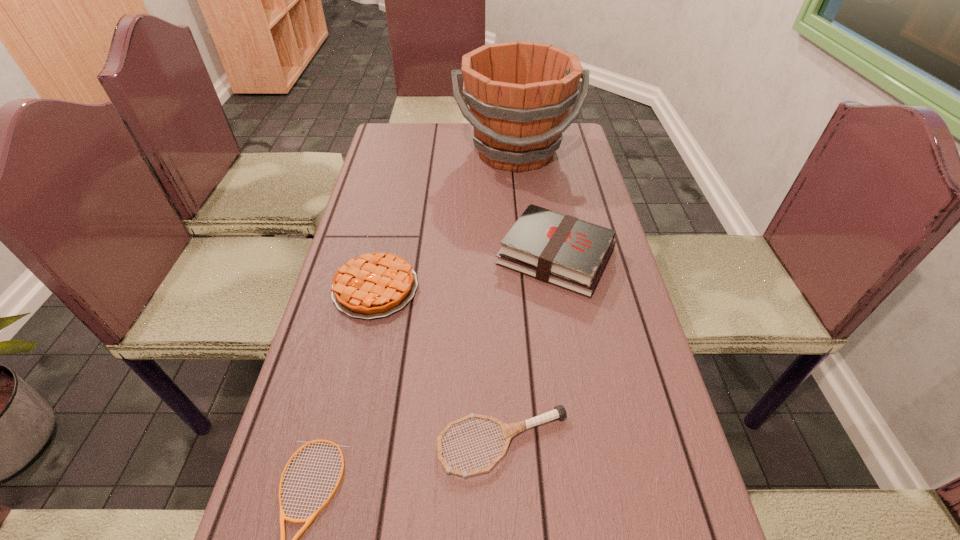
Identify the location of free space between the farthest object and the hardback book. Image resolution: width=960 pixels, height=540 pixels. (536, 204).

Locate an element on the screen. The width and height of the screenshot is (960, 540). object that can be found as the fourth closest to the taller tennis racket is located at coordinates (519, 93).

Choose which object is the second nearest neighbor to the farthest object. Please provide its 2D coordinates. Your answer should be formatted as a tuple, i.e. [(x, y)], where the tuple contains the x and y coordinates of a point satisfying the conditions above.

[(374, 285)]

Where is `vacant space that satisfies the following two spatial constraints: 1. on the handle side of the tallest object; 2. on the left side of the hardback book`? The width and height of the screenshot is (960, 540). vacant space that satisfies the following two spatial constraints: 1. on the handle side of the tallest object; 2. on the left side of the hardback book is located at coordinates (527, 256).

In order to click on vacant space that satisfies the following two spatial constraints: 1. on the back side of the taller tennis racket; 2. on the left side of the hardback book in this screenshot , I will do `click(496, 256)`.

Locate an element on the screen. The width and height of the screenshot is (960, 540). vacant space that satisfies the following two spatial constraints: 1. on the handle side of the farthest object; 2. on the right side of the fourth shortest object is located at coordinates (527, 256).

Locate an element on the screen. The image size is (960, 540). free location that satisfies the following two spatial constraints: 1. on the front side of the taller tennis racket; 2. on the left side of the pie is located at coordinates (341, 443).